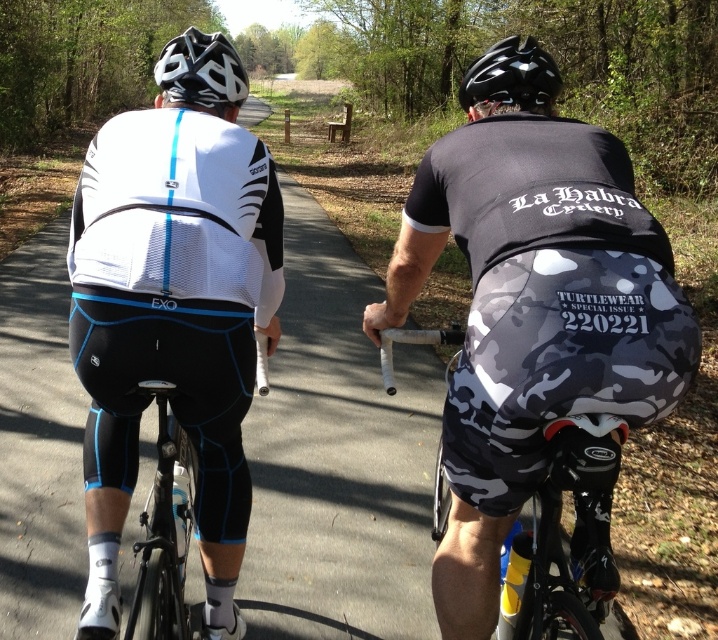
You are a photographer trying to capture both the camouflage fabric shorts at center and the matte black helmet at upper left in the same frame. Based on their positions, which object should you focus on first to ensure both are in the shot?

You should focus on the matte black helmet at upper left first because the camouflage fabric shorts at center are to the right of it, so by centering the helmet, you can adjust the frame to include both objects.

You are a photographer trying to capture a clear shot of both the camouflage fabric bicycle at center and the matte black helmet at upper left. Since you want both objects in focus, which one should you adjust your camera focus on first to ensure the closest object is sharp?

The camouflage fabric bicycle at center is closer to the viewer than the matte black helmet at upper left, so you should focus on the camouflage fabric bicycle at center first to ensure proper depth of field for both objects.

Looking at this image, you are a drone operator trying to capture a photo of two cyclists. You need to position your drone so that both cyclists are in frame. The first cyclist is at point [516,458] and the second cyclist is at point [220,36]. Which cyclist should you focus on first to ensure they are centered in the frame?

You should focus on the cyclist at point [516,458] first because it is in front of the cyclist at point [220,36], so centering on the front cyclist will keep both in frame.